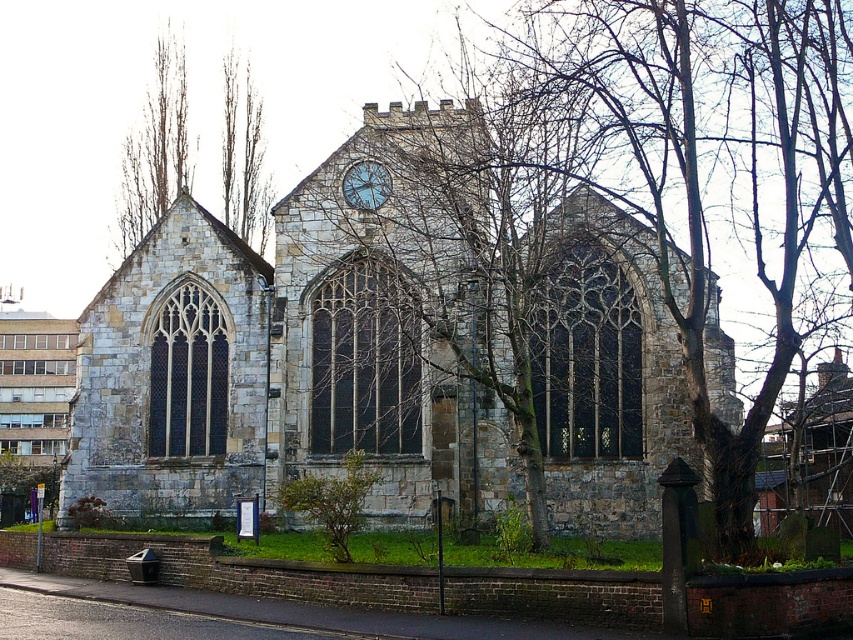
You are standing at the point marked by coordinates (379, 356) in the image of the historic stone church. What significant structure is located at this position?

The point at coordinates (379, 356) marks the location of the stone church at center, as indicated by the description.

You are standing in front of the stone church at center and want to take a photo of the bare wood tree at upper left. Which direction should you turn to face the tree?

The stone church at center is positioned on the right side of the bare wood tree at upper left, so you should turn to your left to face the tree.